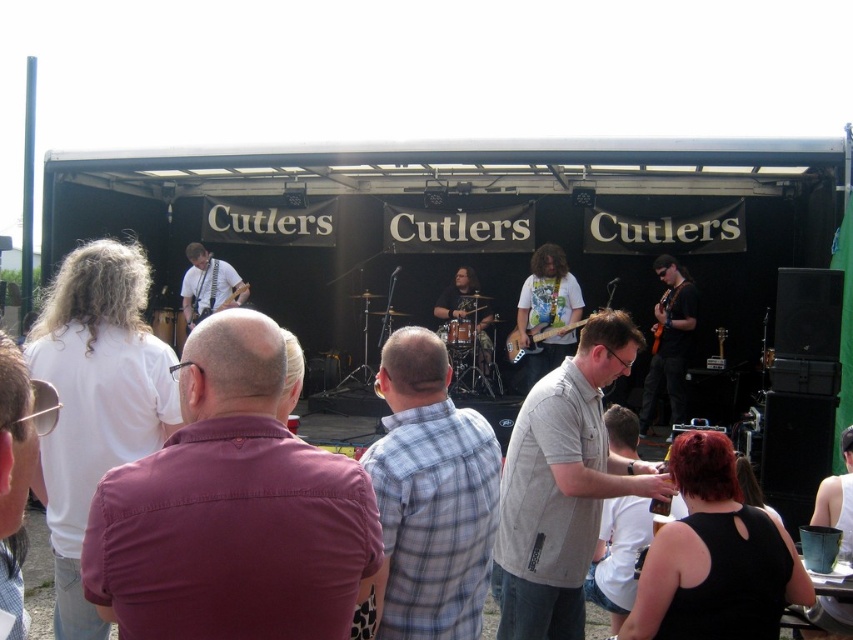
You are a photographer positioned at the camera location. You want to capture a closeup shot of the shiny black guitar at right. Given that your camera can focus on objects within 30 feet, will you be able to get a clear closeup?

The shiny black guitar at right is 31.49 feet away from the camera, which is beyond the 30 feet focus range. Therefore, you won not be able to get a clear closeup.

You are a photographer at the event and want to capture the shiny black guitar at right in your shot. The stage is set up so that the guitar is at coordinates 0.534 on the x axis and 0.785 on the y axis. If your camera frame is centered at the origin, will the guitar appear in the center of your photo?

The shiny black guitar at right is positioned at point (x=669, y=340), which is not the center of the frame since the center would be at (x=426, y=320). Therefore, the guitar will not be centered in the photo.